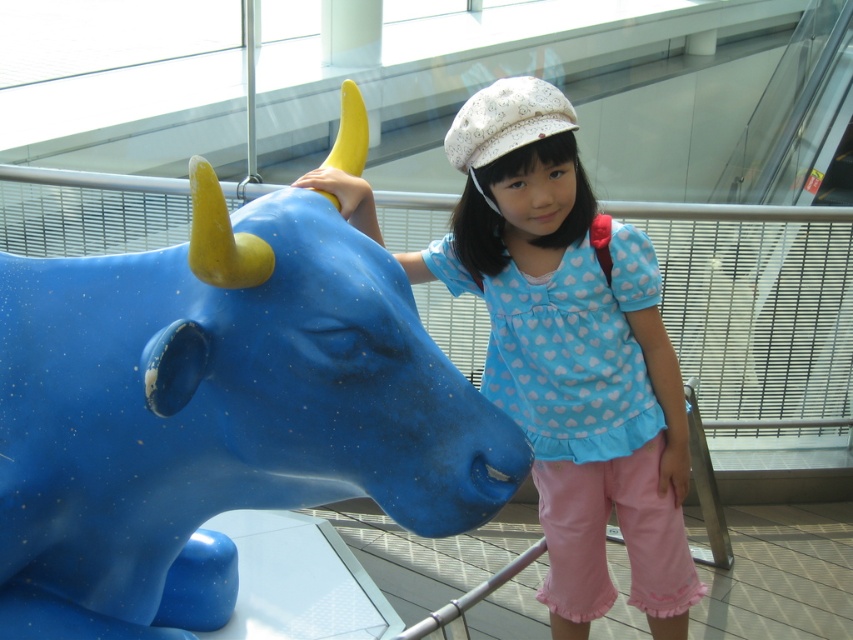
Is blue glossy bull at left closer to the viewer compared to matte blue statue at center?

Yes, it is.

Which is more to the left, blue glossy bull at left or matte blue statue at center?

blue glossy bull at left

Is point (267, 216) farther from camera compared to point (421, 278)?

No, it is not.

The image size is (853, 640). What are the coordinates of `blue glossy bull at left` in the screenshot? It's located at (218, 412).